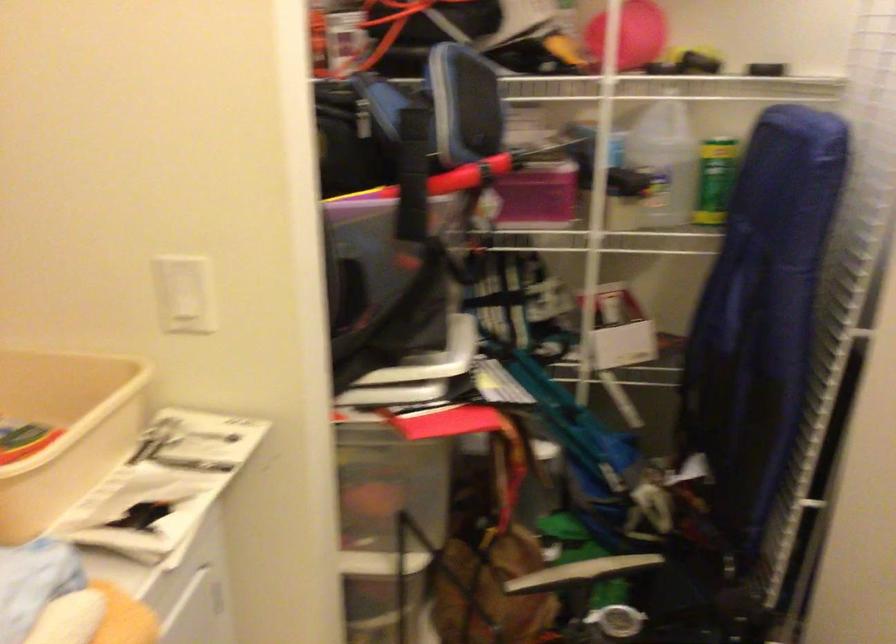
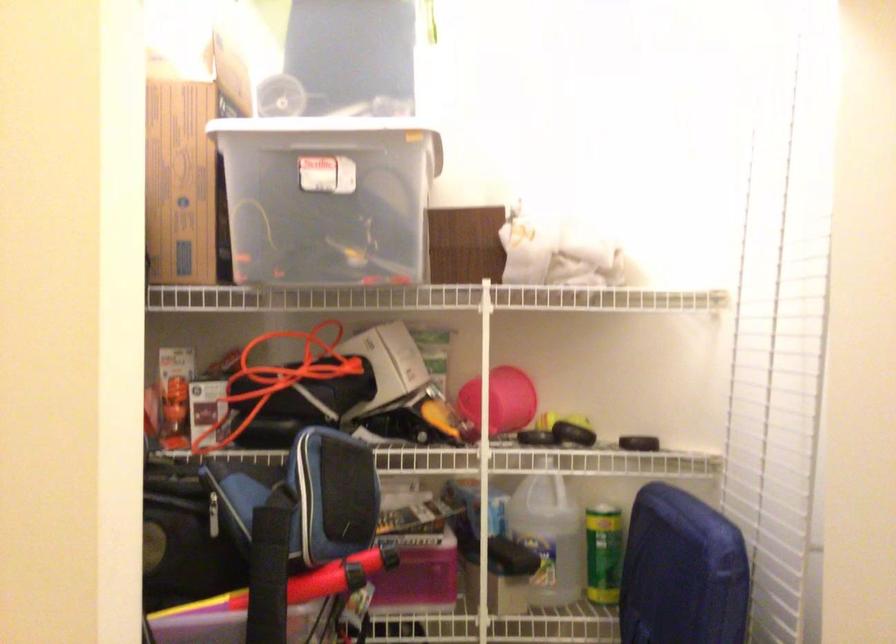
Where in the second image is the point corresponding to (x=436, y=172) from the first image?

(298, 583)